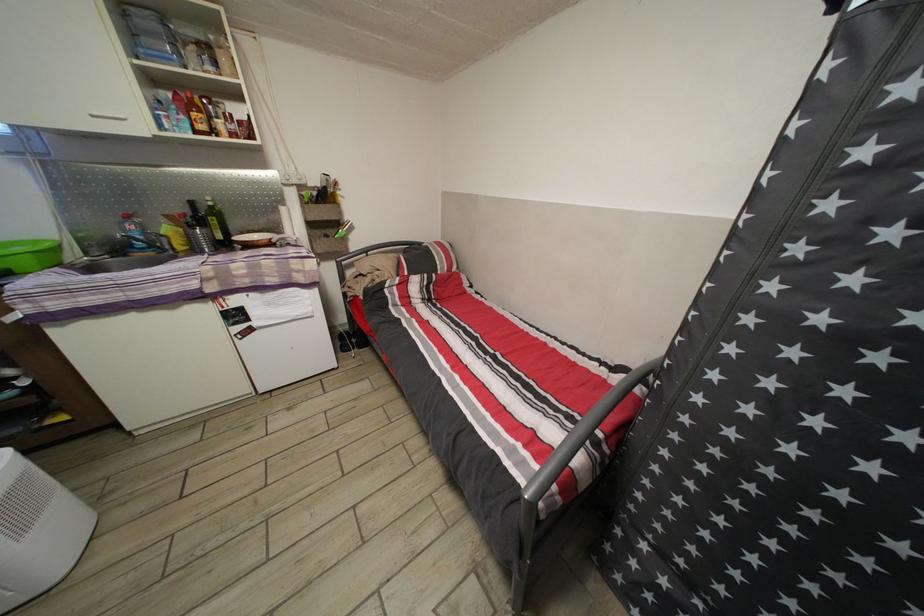
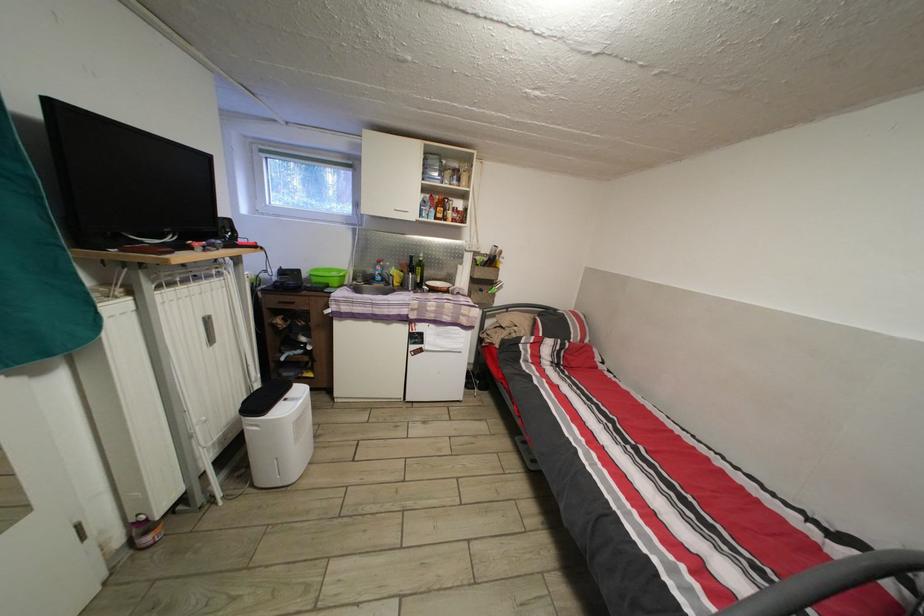
Find the pixel in the second image that matches point 200,209 in the first image.

(419, 265)